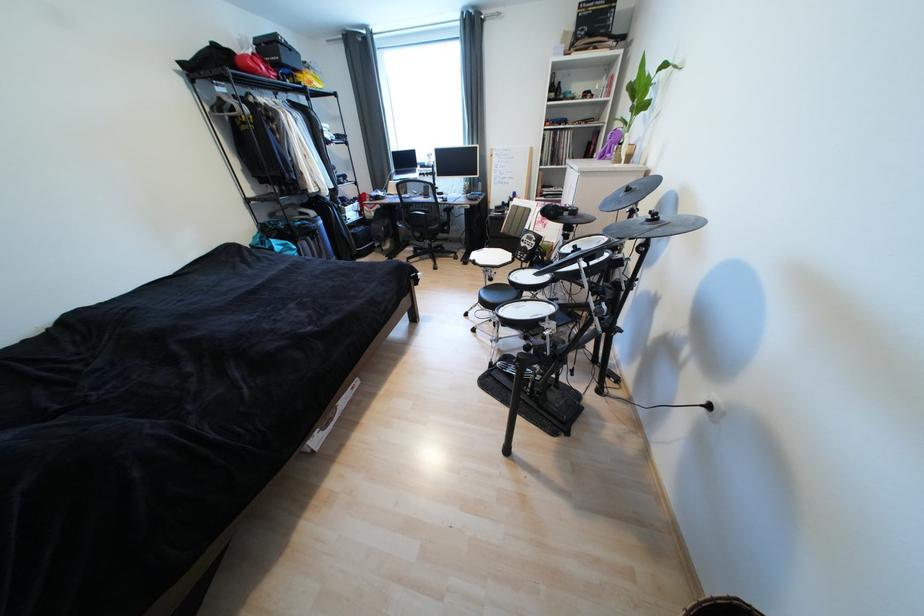
Locate an element on the screen. This screenshot has width=924, height=616. black chair sitting surface is located at coordinates (448, 209).